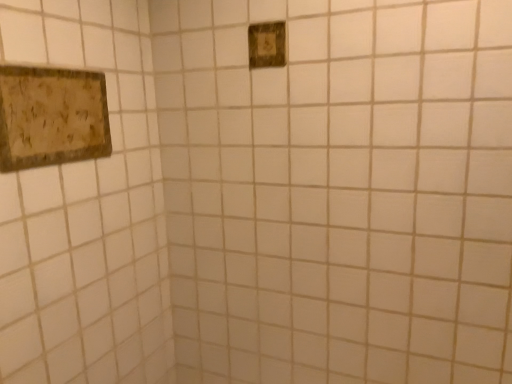
Question: Does point (30, 104) appear closer or farther from the camera than point (247, 34)?

Choices:
 (A) closer
 (B) farther

Answer: (A)

Question: Relative to green textured switch at upper center, is wooden textured picture frame at upper left in front or behind?

Choices:
 (A) front
 (B) behind

Answer: (A)

Question: Considering the positions of wooden textured picture frame at upper left and green textured switch at upper center in the image, is wooden textured picture frame at upper left bigger or smaller than green textured switch at upper center?

Choices:
 (A) small
 (B) big

Answer: (B)

Question: Considering the positions of point (251, 49) and point (61, 74), is point (251, 49) closer or farther from the camera than point (61, 74)?

Choices:
 (A) closer
 (B) farther

Answer: (B)

Question: Considering the positions of green textured switch at upper center and wooden textured picture frame at upper left in the image, is green textured switch at upper center taller or shorter than wooden textured picture frame at upper left?

Choices:
 (A) tall
 (B) short

Answer: (B)

Question: Is green textured switch at upper center in front of or behind wooden textured picture frame at upper left in the image?

Choices:
 (A) behind
 (B) front

Answer: (A)

Question: From the image's perspective, is green textured switch at upper center above or below wooden textured picture frame at upper left?

Choices:
 (A) above
 (B) below

Answer: (A)